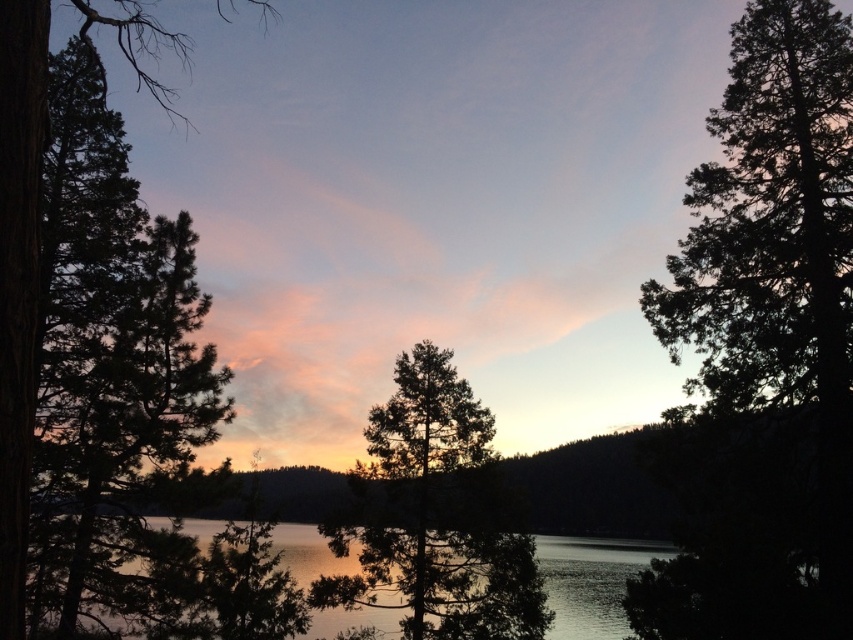
Can you confirm if green textured tree at center is bigger than green textured pine tree at left?

No.

Can you confirm if green textured tree at center is positioned below green textured pine tree at left?

Correct, green textured tree at center is located below green textured pine tree at left.

The height and width of the screenshot is (640, 853). I want to click on green textured tree at center, so click(434, 515).

Can you confirm if green textured tree at center is shorter than glistening silver water at center?

Indeed, green textured tree at center has a lesser height compared to glistening silver water at center.

Is green textured tree at center positioned at the back of glistening silver water at center?

That is True.

Which is behind, point (407, 410) or point (340, 612)?

The point (340, 612) is more distant.

Locate an element on the screen. green textured tree at center is located at coordinates (434, 515).

Who is lower down, dark green textured tree at right or green textured tree at center?

green textured tree at center is lower down.

I want to click on dark green textured tree at right, so click(770, 221).

The width and height of the screenshot is (853, 640). In order to click on dark green textured tree at right in this screenshot , I will do coord(770,221).

Identify the location of dark green textured tree at right. (770, 221).